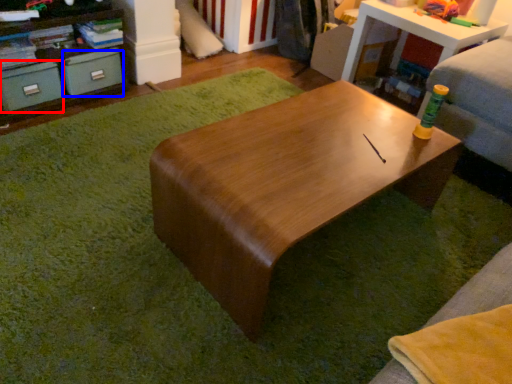
Question: Which point is further to the camera, drawer (highlighted by a red box) or drawer (highlighted by a blue box)?

Choices:
 (A) drawer
 (B) drawer

Answer: (B)